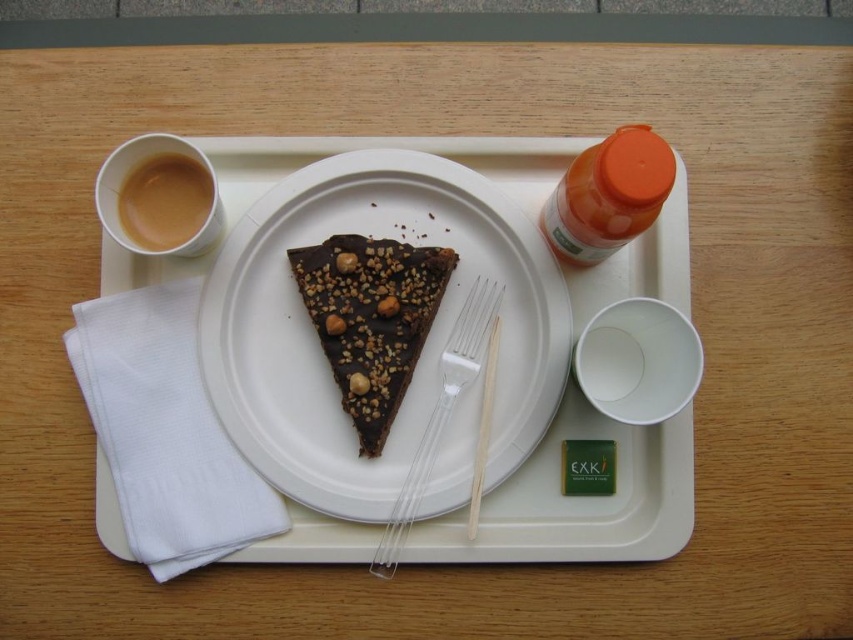
In the scene shown: Which of these two, chocolate-coated cake at center or orange matte bottle at upper right, stands taller?

Standing taller between the two is chocolate-coated cake at center.

Between point (238, 248) and point (585, 180), which one is positioned behind?

The point (238, 248) is more distant.

At what (x,y) coordinates should I click in order to perform the action: click on chocolate-coated cake at center. Please return your answer as a coordinate pair (x, y). Looking at the image, I should click on (424, 342).

Find the location of `chocolatecrumblyslice at center`. chocolatecrumblyslice at center is located at coordinates (370, 317).

Between chocolatecrumblyslice at center and brown textured nut at center, which one has more height?

Standing taller between the two is chocolatecrumblyslice at center.

Find the location of a particular element. The width and height of the screenshot is (853, 640). chocolatecrumblyslice at center is located at coordinates (370, 317).

Locate an element on the screen. This screenshot has width=853, height=640. chocolatecrumblyslice at center is located at coordinates (370, 317).

Is chocolatecrumblyslice at center shorter than orange matte bottle at upper right?

No.

Does chocolatecrumblyslice at center have a larger size compared to orange matte bottle at upper right?

No.

Image resolution: width=853 pixels, height=640 pixels. I want to click on chocolatecrumblyslice at center, so click(x=370, y=317).

You are a GUI agent. You are given a task and a screenshot of the screen. Output one action in this format:
    pyautogui.click(x=<x>, y=<y>)
    Task: Click on the chocolatecrumblyslice at center
    The width and height of the screenshot is (853, 640).
    Given the screenshot: What is the action you would take?
    pyautogui.click(x=370, y=317)